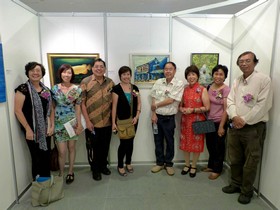
Identify the location of wall to the right of people. The image size is (280, 210). (270, 44).